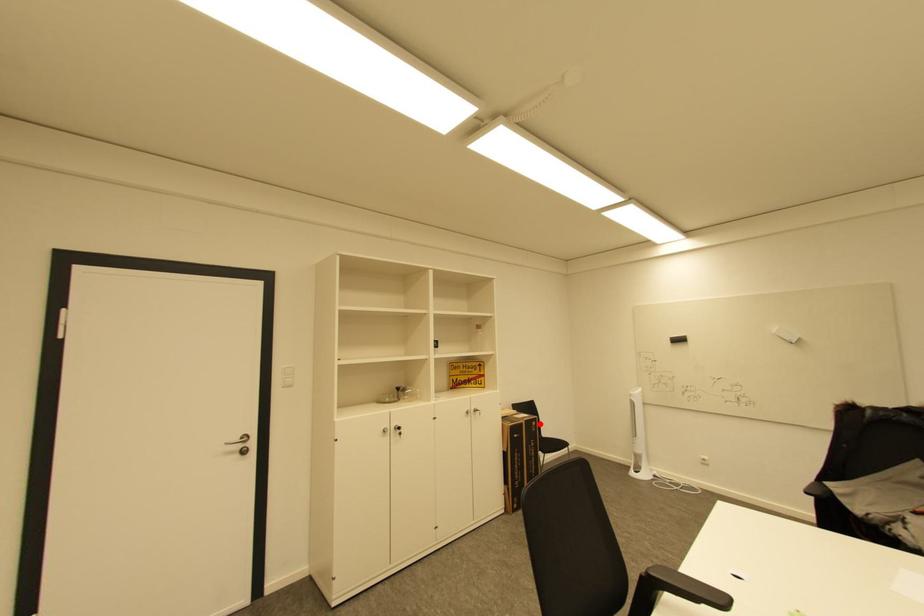
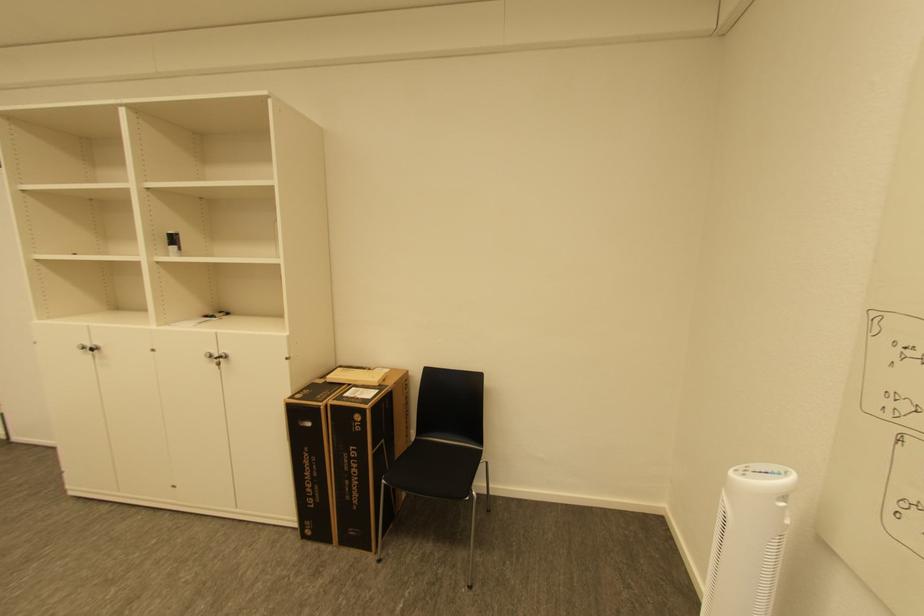
Locate, in the second image, the point that corresponds to the highlighted location in the first image.

(363, 418)